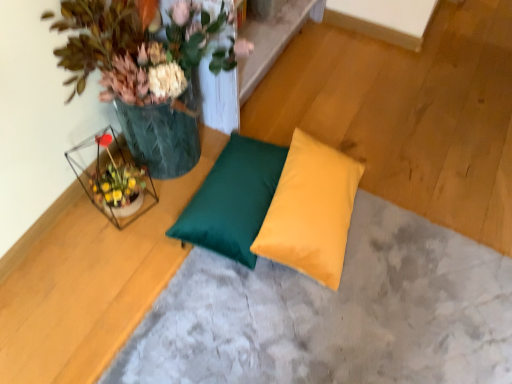
Where is `free space behind matte green pillow at center`? Image resolution: width=512 pixels, height=384 pixels. free space behind matte green pillow at center is located at coordinates (387, 122).